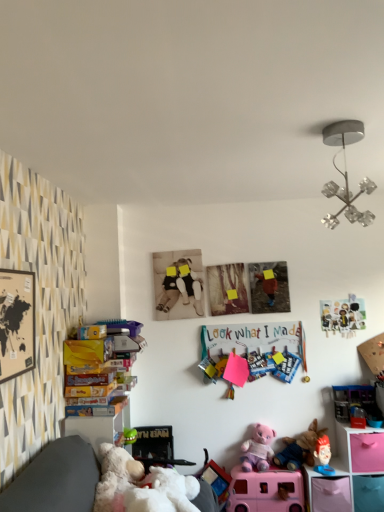
Question: Is multicolored paper clips at center turned away from metallic silver chandelier at upper right?

Choices:
 (A) no
 (B) yes

Answer: (A)

Question: Is multicolored paper clips at center positioned before metallic silver chandelier at upper right?

Choices:
 (A) no
 (B) yes

Answer: (A)

Question: From the image's perspective, is multicolored paper clips at center over metallic silver chandelier at upper right?

Choices:
 (A) yes
 (B) no

Answer: (B)

Question: Is multicolored paper clips at center far from metallic silver chandelier at upper right?

Choices:
 (A) yes
 (B) no

Answer: (A)

Question: Is multicolored paper clips at center not within metallic silver chandelier at upper right?

Choices:
 (A) no
 (B) yes

Answer: (B)

Question: Based on their positions, is black matte picture frame at left located to the left or right of matte plastic picture frame at upper right, acting as the first toy starting from the top?

Choices:
 (A) left
 (B) right

Answer: (A)

Question: Does point (11, 307) appear closer or farther from the camera than point (337, 314)?

Choices:
 (A) closer
 (B) farther

Answer: (A)

Question: Which is correct: black matte picture frame at left is inside matte plastic picture frame at upper right, acting as the first toy starting from the top, or outside of it?

Choices:
 (A) outside
 (B) inside

Answer: (A)

Question: Relative to matte plastic picture frame at upper right, acting as the first toy starting from the top, is black matte picture frame at left in front or behind?

Choices:
 (A) behind
 (B) front

Answer: (B)

Question: From a real-world perspective, is pink plastic toy car at lower right, which is the fifth toy from bottom to top, above or below matte plastic picture frame at upper right, the 6th toy ordered from the bottom?

Choices:
 (A) above
 (B) below

Answer: (B)

Question: Considering the positions of pink plastic toy car at lower right, which is the fifth toy from bottom to top, and matte plastic picture frame at upper right, acting as the first toy starting from the top, in the image, is pink plastic toy car at lower right, which is the fifth toy from bottom to top, taller or shorter than matte plastic picture frame at upper right, acting as the first toy starting from the top,?

Choices:
 (A) tall
 (B) short

Answer: (B)

Question: Is pink plastic toy car at lower right, which appears as the second toy when viewed from the top, bigger or smaller than matte plastic picture frame at upper right, acting as the first toy starting from the top?

Choices:
 (A) big
 (B) small

Answer: (A)

Question: Is point (369, 403) positioned closer to the camera than point (345, 307)?

Choices:
 (A) closer
 (B) farther

Answer: (A)

Question: In terms of height, does purple plush bear at center, the 5th toy positioned from the top, look taller or shorter compared to multicolored paper clips at center?

Choices:
 (A) short
 (B) tall

Answer: (A)

Question: Is point (246, 465) closer or farther from the camera than point (263, 367)?

Choices:
 (A) closer
 (B) farther

Answer: (A)